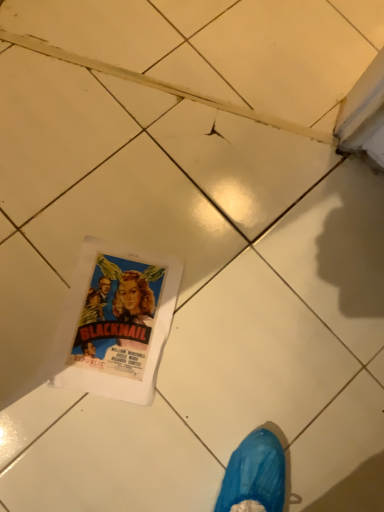
What are the coordinates of `matte paper poster at lower left` in the screenshot? It's located at (116, 322).

Describe the element at coordinates (116, 322) in the screenshot. The image size is (384, 512). I see `matte paper poster at lower left` at that location.

Where is `matte paper poster at lower left`? This screenshot has height=512, width=384. matte paper poster at lower left is located at coordinates (116, 322).